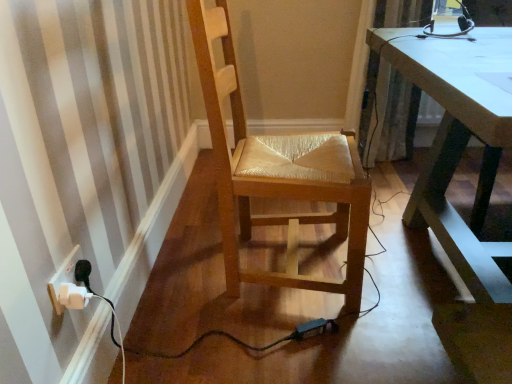
Question: In the image, is textured beige curtain at upper right positioned in front of or behind white plastic plug at lower left?

Choices:
 (A) behind
 (B) front

Answer: (A)

Question: From a real-world perspective, relative to white plastic plug at lower left, is textured beige curtain at upper right vertically above or below?

Choices:
 (A) above
 (B) below

Answer: (A)

Question: Estimate the real-world distances between objects in this image. Which object is closer to the wooden woven seat at center?

Choices:
 (A) textured beige curtain at upper right
 (B) white plastic plug at lower left

Answer: (B)

Question: Which of these objects is positioned closest to the textured beige curtain at upper right?

Choices:
 (A) wooden woven seat at center
 (B) white plastic plug at lower left

Answer: (A)